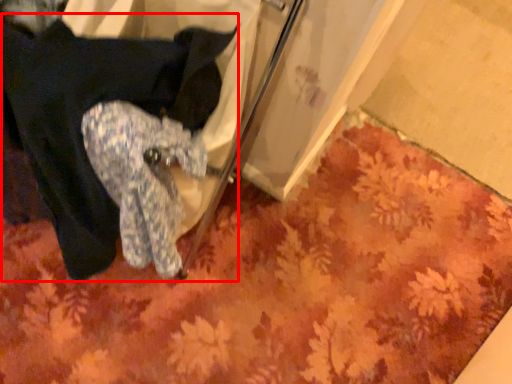
Question: In this image, where is clothing (annotated by the red box) located relative to mat?

Choices:
 (A) right
 (B) left

Answer: (B)